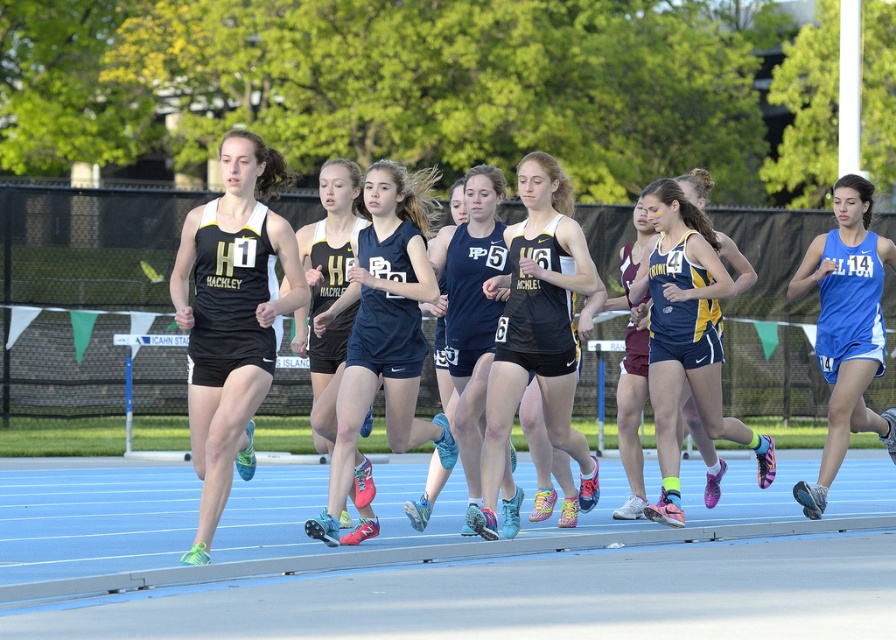
Which is below, blue and yellow athletic uniform at center or blue fabric tank top at right?

blue and yellow athletic uniform at center is below.

Looking at this image, which of these two, blue and yellow athletic uniform at center or blue fabric tank top at right, stands taller?

Answer: blue fabric tank top at right is taller.

Who is more distant from viewer, (644, 193) or (863, 205)?

The point (863, 205) is more distant.

Locate an element on the screen. blue and yellow athletic uniform at center is located at coordinates (685, 337).

Does black matte tank top at center lie behind blue and yellow athletic uniform at center?

No.

Is black matte tank top at center to the left of blue and yellow athletic uniform at center from the viewer's perspective?

Yes, black matte tank top at center is to the left of blue and yellow athletic uniform at center.

Locate an element on the screen. Image resolution: width=896 pixels, height=640 pixels. black matte tank top at center is located at coordinates (231, 316).

Where is `black matte tank top at center`? black matte tank top at center is located at coordinates (231, 316).

Which is below, matte blue tank top at center or black matte tank top at left?

Positioned lower is matte blue tank top at center.

Is point (507, 529) positioned after point (213, 358)?

Yes, it is behind point (213, 358).

Identify the location of matte blue tank top at center. The image size is (896, 640). (471, 310).